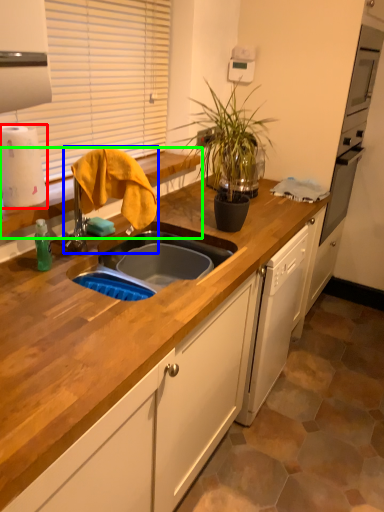
Question: Estimate the real-world distances between objects in this image. Which object is closer to paper towel (highlighted by a red box), faucet (highlighted by a blue box) or countertop (highlighted by a green box)?

Choices:
 (A) faucet
 (B) countertop

Answer: (A)